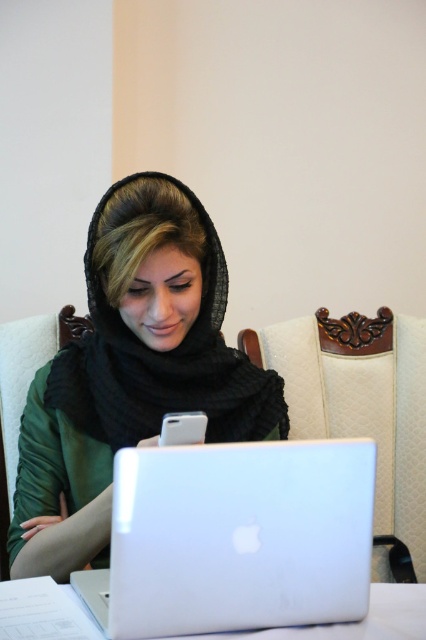
You are a photographer standing in front of the scene described. You want to take a closeup shot of the matte black hijab at center without including any other objects in the frame. Given your current position, is the distance sufficient to capture the hijab clearly in the photo?

The distance between the matte black hijab at center and the viewer is 35.53 inches. This distance should be sufficient to capture the hijab clearly in a closeup shot without including other objects, assuming the camera has a suitable zoom or focal length.

You are a photographer trying to capture the woman without any obstructions. The matte black hijab at center and the silver metallic laptop at center are in your way. Which object should you move to get a clear view of her face?

Answer: You should move the matte black hijab at center because it is positioned over the silver metallic laptop at center, blocking the view of her face.